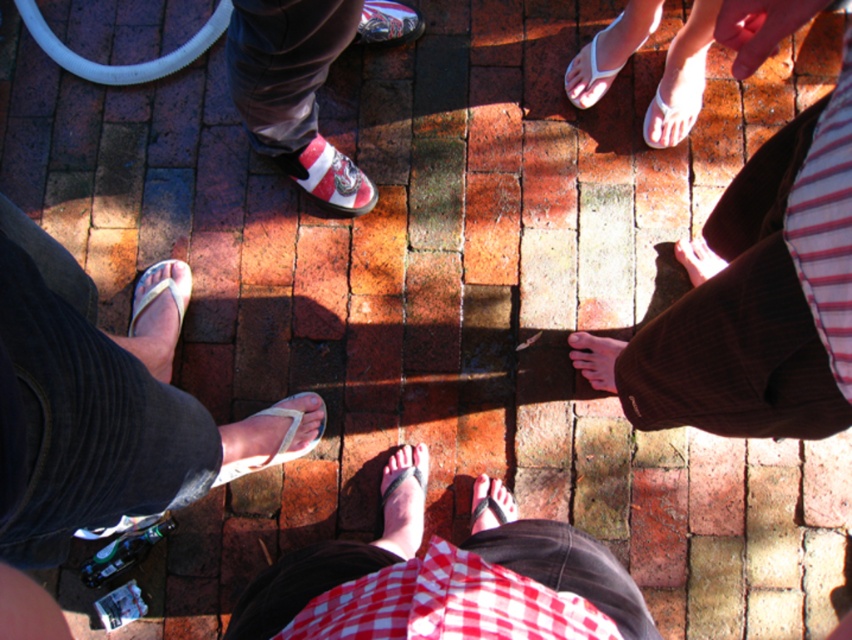
Does white rubber flip-flop at upper center appear on the right side of shiny metallic shoe at center?

Correct, you'll find white rubber flip-flop at upper center to the right of shiny metallic shoe at center.

Between white rubber flip-flop at upper center and shiny metallic shoe at center, which one is positioned higher?

shiny metallic shoe at center is higher up.

This screenshot has width=852, height=640. What do you see at coordinates (676, 92) in the screenshot? I see `white rubber flip-flop at upper center` at bounding box center [676, 92].

The image size is (852, 640). I want to click on white rubber flip-flop at upper center, so (x=676, y=92).

Can you confirm if shiny metallic shoe at center is positioned below smooth brown skin at center?

No.

Which is below, shiny metallic shoe at center or smooth brown skin at center?

smooth brown skin at center is lower down.

Between point (389, 24) and point (616, 390), which one is positioned in front?

Positioned in front is point (616, 390).

You are a GUI agent. You are given a task and a screenshot of the screen. Output one action in this format:
    pyautogui.click(x=<x>, y=<y>)
    Task: Click on the shiny metallic shoe at center
    
    Given the screenshot: What is the action you would take?
    pyautogui.click(x=389, y=22)

Which is above, smooth brown skin at center or matte pink sandal at center?

smooth brown skin at center is above.

Between point (593, 340) and point (470, 524), which one is positioned in front?

Point (470, 524) is in front.

Does point (589, 342) come closer to viewer compared to point (511, 502)?

No.

Where is `smooth brown skin at center`? This screenshot has width=852, height=640. smooth brown skin at center is located at coordinates (596, 358).